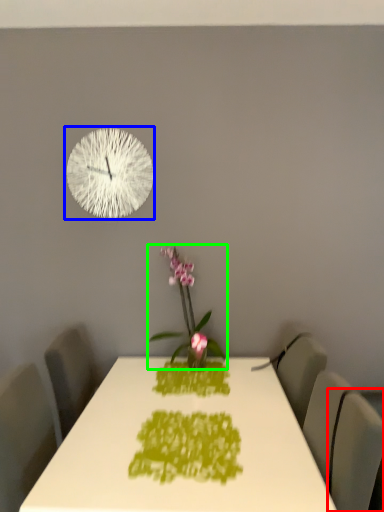
Question: Based on their relative distances, which object is nearer to swivel chair (highlighted by a red box)? Choose from wall clock (highlighted by a blue box) and houseplant (highlighted by a green box).

Choices:
 (A) wall clock
 (B) houseplant

Answer: (B)